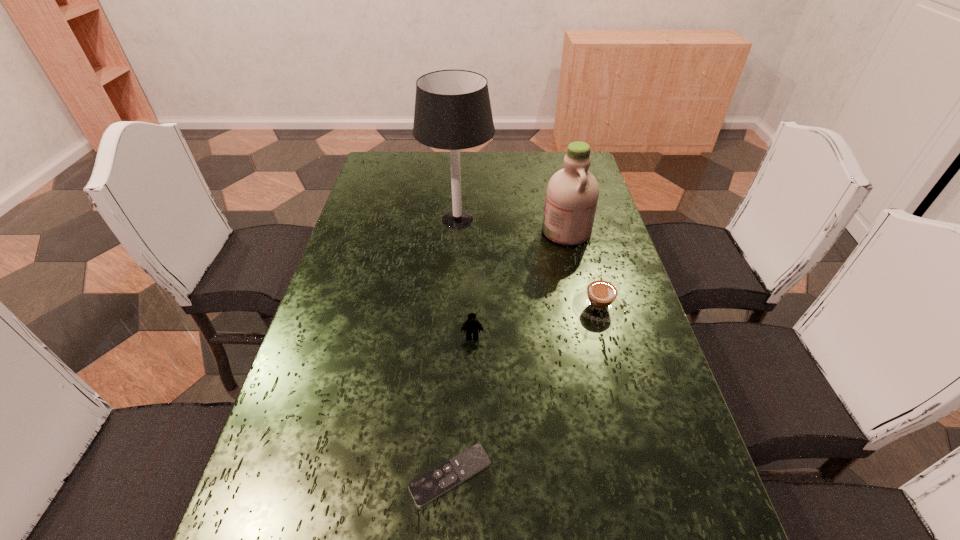
Identify the location of empty space that is in between the second nearest object and the remote control. (462, 406).

The width and height of the screenshot is (960, 540). What are the coordinates of `free spot between the nearest object and the second tallest object` in the screenshot? It's located at (509, 353).

This screenshot has height=540, width=960. Find the location of `free space that is in between the Lego and the cleansing agent`. free space that is in between the Lego and the cleansing agent is located at coordinates (519, 284).

Identify the location of free space between the cappuccino and the fourth farthest object. The image size is (960, 540). (536, 321).

Where is `unoccupied position between the remote control and the table lamp`? The image size is (960, 540). unoccupied position between the remote control and the table lamp is located at coordinates (454, 347).

Identify the location of vacant area between the tallest object and the second tallest object. (512, 225).

This screenshot has width=960, height=540. What are the coordinates of `vacant area that lies between the cleansing agent and the cappuccino` in the screenshot? It's located at pyautogui.click(x=583, y=268).

Image resolution: width=960 pixels, height=540 pixels. I want to click on vacant area between the fourth farthest object and the cleansing agent, so click(519, 284).

The width and height of the screenshot is (960, 540). I want to click on vacant space in between the table lamp and the Lego, so click(465, 278).

Choose which object is the nearest neighbor to the table lamp. Please provide its 2D coordinates. Your answer should be formatted as a tuple, i.e. [(x, y)], where the tuple contains the x and y coordinates of a point satisfying the conditions above.

[(572, 193)]